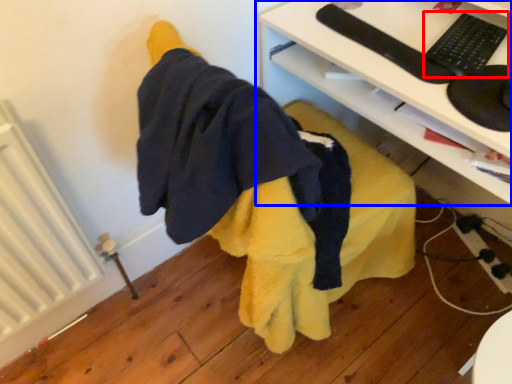
Question: Which point is further to the camera, keyboard (highlighted by a red box) or desk (highlighted by a blue box)?

Choices:
 (A) keyboard
 (B) desk

Answer: (A)